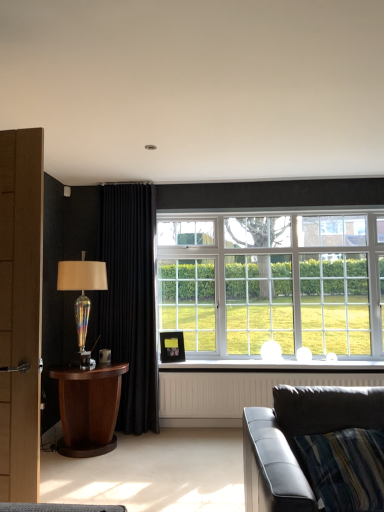
Question: Is white glass window at center taller or shorter than black velvet curtain at left?

Choices:
 (A) tall
 (B) short

Answer: (B)

Question: Considering the positions of white glass window at center and black velvet curtain at left in the image, is white glass window at center bigger or smaller than black velvet curtain at left?

Choices:
 (A) big
 (B) small

Answer: (A)

Question: Estimate the real-world distances between objects in this image. Which object is farther from the wooden table at left?

Choices:
 (A) matte black picture frame at center
 (B) white textured radiator at lower center
 (C) white glass window at center
 (D) leather couch at lower right
 (E) black velvet curtain at left

Answer: (D)

Question: Which of these objects is positioned farthest from the matte black picture frame at center?

Choices:
 (A) white textured radiator at lower center
 (B) leather couch at lower right
 (C) white glossy window sill at lower center
 (D) white glass window at center
 (E) wooden table at left

Answer: (B)